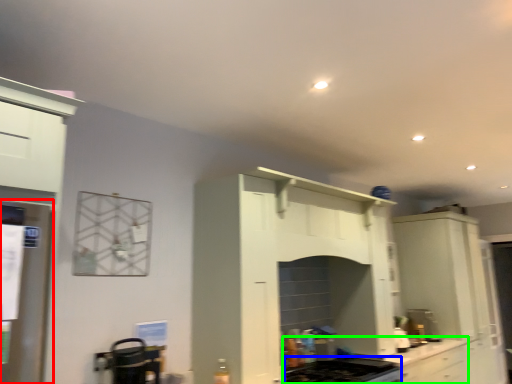
Question: Estimate the real-world distances between objects in this image. Which object is closer to appliance (highlighted by a red box), gas stove (highlighted by a blue box) or countertop (highlighted by a green box)?

Choices:
 (A) gas stove
 (B) countertop

Answer: (A)